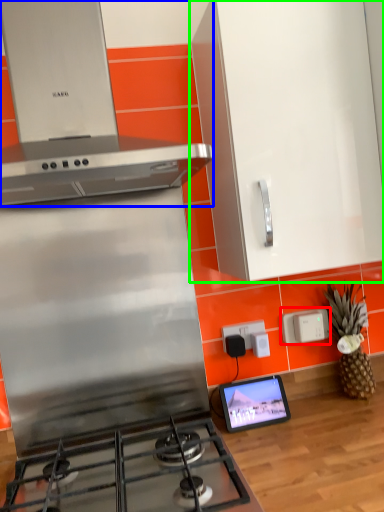
Question: Which is nearer to the electric outlet (highlighted by a red box)? home appliance (highlighted by a blue box) or cabinetry (highlighted by a green box).

Choices:
 (A) home appliance
 (B) cabinetry

Answer: (B)